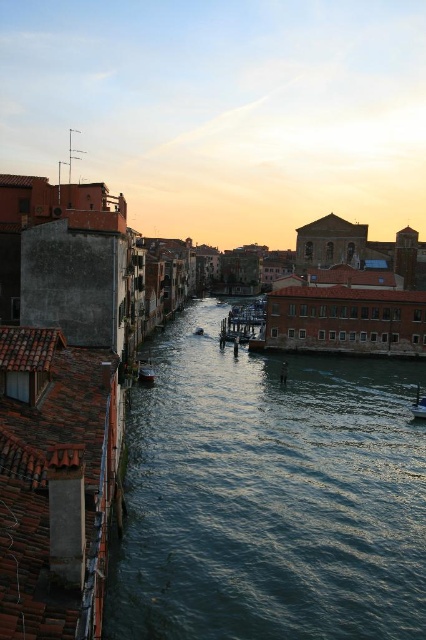
Does greenish water at center appear on the left side of wooden polished boat at center?

No, greenish water at center is not to the left of wooden polished boat at center.

Which is more to the left, greenish water at center or wooden polished boat at center?

Positioned to the left is wooden polished boat at center.

Is point (345, 362) more distant than point (143, 368)?

That is True.

Locate an element on the screen. The height and width of the screenshot is (640, 426). greenish water at center is located at coordinates (270, 497).

Is greenish water at center taller than metallic silver boat at center?

Yes.

Who is positioned more to the left, greenish water at center or metallic silver boat at center?

greenish water at center is more to the left.

Which is in front, point (371, 528) or point (417, 400)?

Positioned in front is point (371, 528).

This screenshot has height=640, width=426. Find the location of `greenish water at center`. greenish water at center is located at coordinates (270, 497).

Can you confirm if wooden polished boat at center is positioned above metallic silver boat at center?

Yes, wooden polished boat at center is above metallic silver boat at center.

Does wooden polished boat at center appear on the left side of metallic silver boat at center?

Indeed, wooden polished boat at center is positioned on the left side of metallic silver boat at center.

Which is behind, point (149, 369) or point (425, 403)?

The point (149, 369) is more distant.

What are the coordinates of `wooden polished boat at center` in the screenshot? It's located at (146, 371).